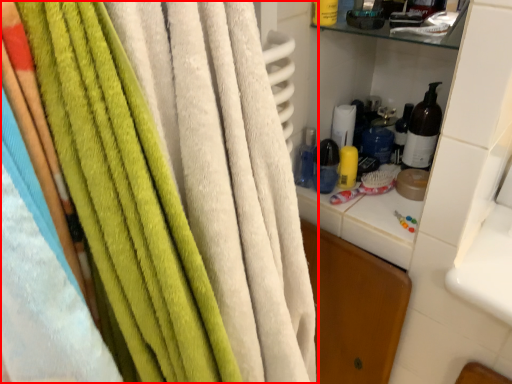
Question: From the image, what is the correct spatial relationship of towel (annotated by the red box) in relation to bottle?

Choices:
 (A) right
 (B) left

Answer: (B)